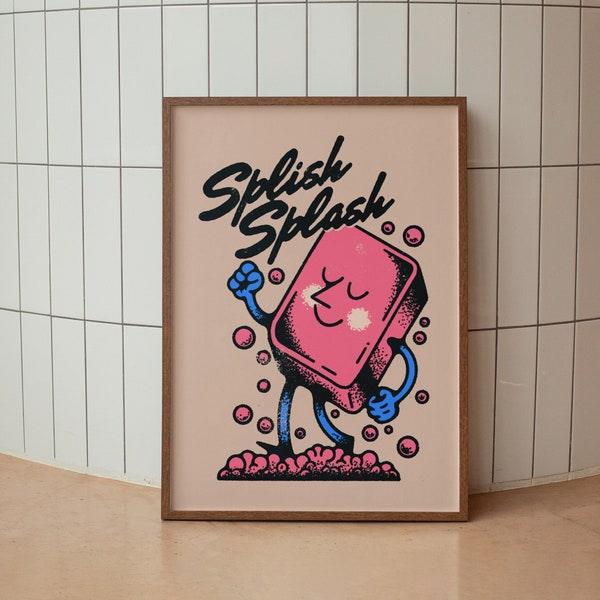
Where is `tile`? Image resolution: width=600 pixels, height=600 pixels. tile is located at coordinates (103, 247), (533, 238).